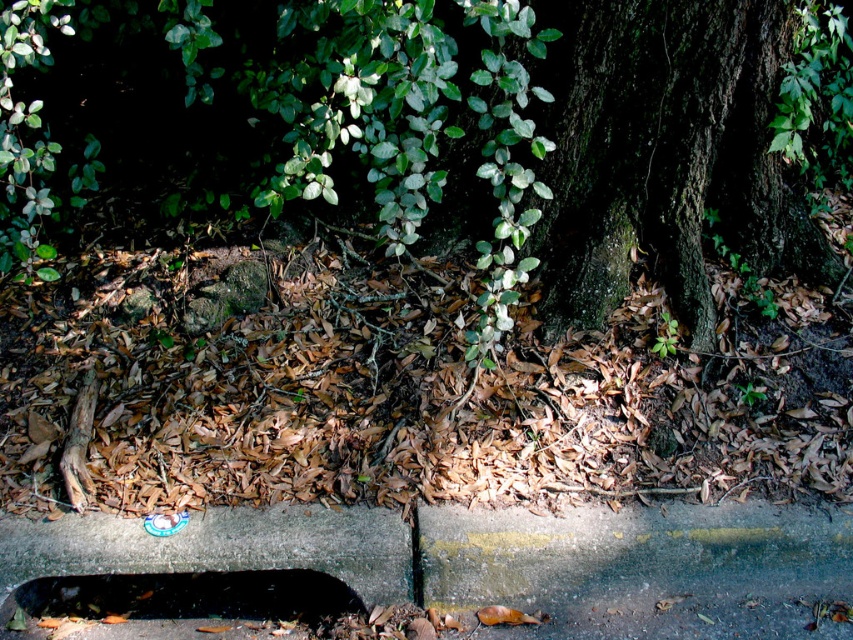
Question: Considering the relative positions of green rough bark tree trunk at center and dark gray concrete hole at lower center in the image provided, where is green rough bark tree trunk at center located with respect to dark gray concrete hole at lower center?

Choices:
 (A) below
 (B) above

Answer: (B)

Question: Is gray concrete pavement at lower center thinner than dark gray concrete hole at lower center?

Choices:
 (A) no
 (B) yes

Answer: (A)

Question: Does gray concrete pavement at lower center appear on the right side of green rough bark tree trunk at center?

Choices:
 (A) yes
 (B) no

Answer: (B)

Question: Which object is positioned closest to the gray concrete pavement at lower center?

Choices:
 (A) dark gray concrete hole at lower center
 (B) green rough bark tree trunk at center

Answer: (A)

Question: Which of the following is the closest to the observer?

Choices:
 (A) (546, 257)
 (B) (35, 588)
 (C) (144, 602)

Answer: (B)

Question: Which object is closer to the camera taking this photo?

Choices:
 (A) gray concrete pavement at lower center
 (B) dark gray concrete hole at lower center

Answer: (A)